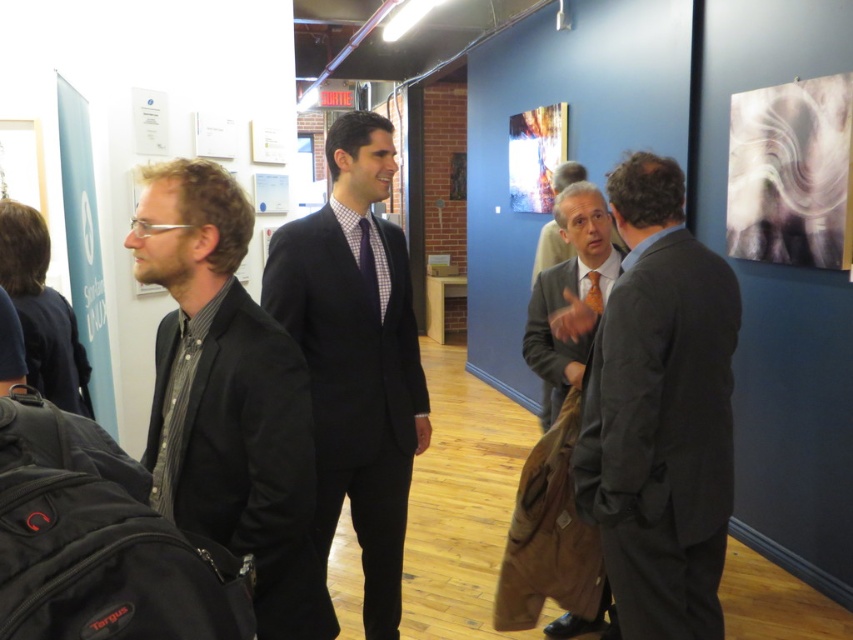
You are a photographer setting up a camera in the art gallery. You notice the matte black suit at center and the checkered fabric tie at center. Which object should you focus on if you want to capture the larger one in your shot?

The matte black suit at center is bigger than the checkered fabric tie at center, so you should focus on the matte black suit at center to capture the larger one.

You are an art gallery security guard who needs to walk from the black matte suit at left to the matte black suit at center. Is the distance between them sufficient for you to walk through without needing to detour around any obstacles?

The distance between the black matte suit at left and the matte black suit at center is 24.26 inches, which is too narrow for a person to walk through comfortably. You would need to detour around the area.